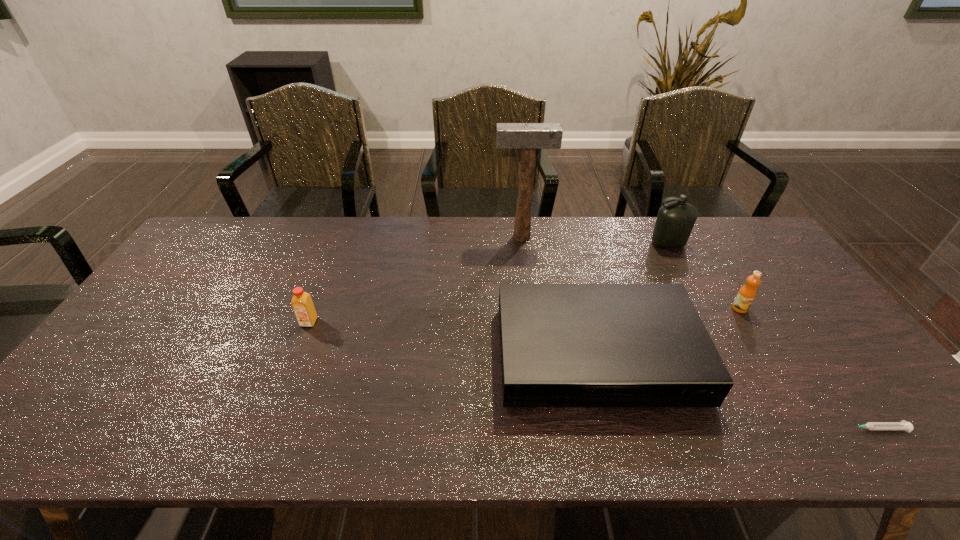
Image resolution: width=960 pixels, height=540 pixels. Find the location of `free space located on the front of the mallet`. free space located on the front of the mallet is located at coordinates (528, 296).

Locate an element on the screen. This screenshot has width=960, height=540. vacant space located 0.070m on the front of the bottle is located at coordinates (679, 265).

Locate an element on the screen. Image resolution: width=960 pixels, height=540 pixels. free region located on the front label of the farther orange juice is located at coordinates (783, 378).

The height and width of the screenshot is (540, 960). Find the location of `vacant region located 0.050m on the front and back of the leftmost object`. vacant region located 0.050m on the front and back of the leftmost object is located at coordinates (301, 342).

Locate an element on the screen. Image resolution: width=960 pixels, height=540 pixels. free spot located 0.070m at the front of the CD player for disc insertion is located at coordinates (618, 438).

Where is `vacant region located 0.380m at the needle end of the nearest object`? Image resolution: width=960 pixels, height=540 pixels. vacant region located 0.380m at the needle end of the nearest object is located at coordinates tap(675, 429).

Image resolution: width=960 pixels, height=540 pixels. What are the coordinates of `vacant space located 0.070m at the needle end of the nearest object` in the screenshot? It's located at (814, 429).

The image size is (960, 540). Identify the location of free location located 0.210m at the needle end of the nearest object. (751, 429).

At what (x,y) coordinates should I click in order to perform the action: click on mallet positioned at the far edge. Please return your answer as a coordinate pair (x, y). Looking at the image, I should click on (527, 137).

This screenshot has width=960, height=540. Identify the location of bottle situated at the far edge. (675, 220).